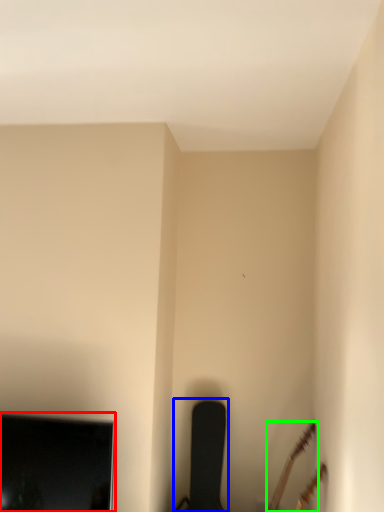
Question: Considering the real-world distances, which object is farthest from television (highlighted by a red box)? chair (highlighted by a blue box) or guitar (highlighted by a green box)?

Choices:
 (A) chair
 (B) guitar

Answer: (B)